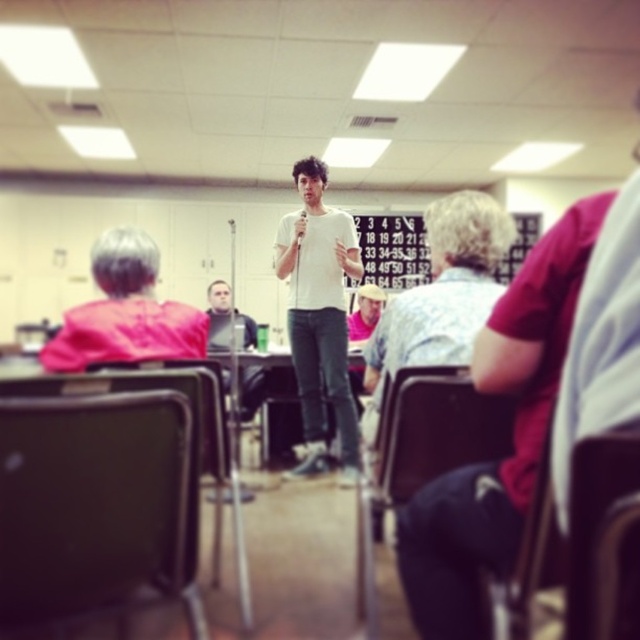
Question: Where is pink fabric shirt at left located in relation to black plastic chair at lower left in the image?

Choices:
 (A) above
 (B) below

Answer: (A)

Question: Can you confirm if white matte shirt at center is smaller than light brown leather hat at center?

Choices:
 (A) no
 (B) yes

Answer: (A)

Question: Among these objects, which one is nearest to the camera?

Choices:
 (A) black plastic chair at lower left
 (B) black plastic chair at lower right

Answer: (B)

Question: Which object appears closest to the camera in this image?

Choices:
 (A) white matte shirt at center
 (B) pink fabric shirt at left
 (C) black leather chair at lower left
 (D) brown leather chair at lower right

Answer: (D)

Question: Is pink fabric shirt at left wider than white paperboard at center?

Choices:
 (A) no
 (B) yes

Answer: (A)

Question: Which of the following is the farthest from the observer?

Choices:
 (A) (538, 230)
 (B) (436, 445)
 (C) (17, 531)

Answer: (A)